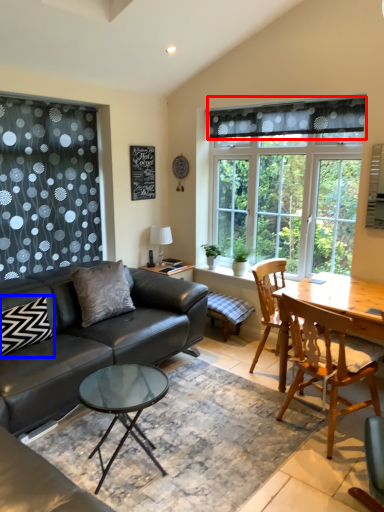
Question: Which point is further to the camera, curtain (highlighted by a red box) or pillow (highlighted by a blue box)?

Choices:
 (A) curtain
 (B) pillow

Answer: (A)